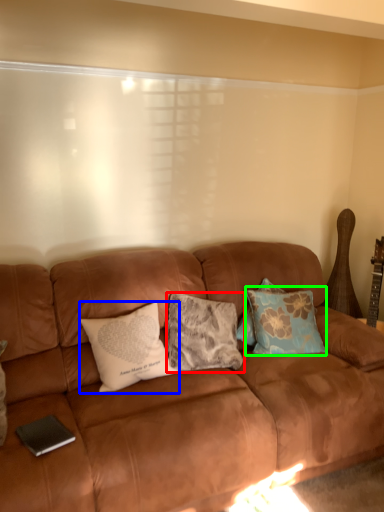
Question: Which is nearer to the pillow (highlighted by a red box)? pillow (highlighted by a blue box) or pillow (highlighted by a green box).

Choices:
 (A) pillow
 (B) pillow

Answer: (A)